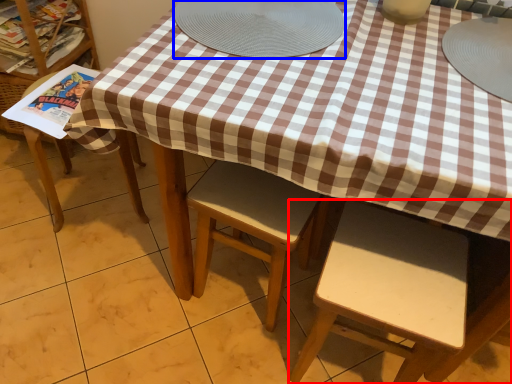
Question: Among these objects, which one is farthest to the camera, chair (highlighted by a red box) or platter (highlighted by a blue box)?

Choices:
 (A) chair
 (B) platter

Answer: (B)